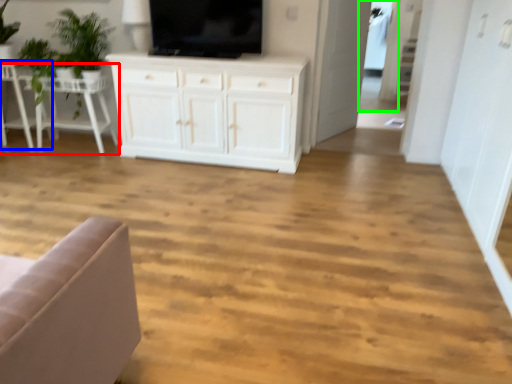
Question: Based on their relative distances, which object is nearer to table (highlighted by a red box)? Choose from chair (highlighted by a blue box) and glass door (highlighted by a green box).

Choices:
 (A) chair
 (B) glass door

Answer: (A)